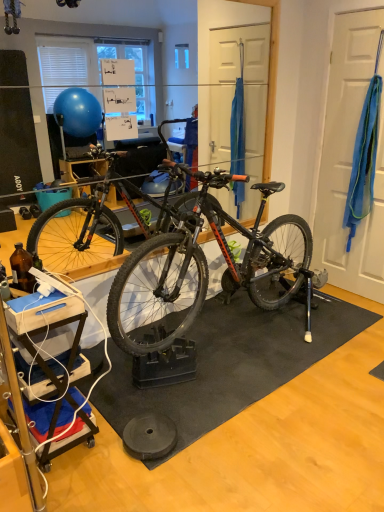
What is the approximate height of black rubber mat at center?

black rubber mat at center is 1.62 inches tall.

Describe the element at coordinates (231, 362) in the screenshot. I see `black rubber mat at center` at that location.

You are a GUI agent. You are given a task and a screenshot of the screen. Output one action in this format:
    pyautogui.click(x=<x>, y=<y>)
    Task: Click on the black rubber mat at center
    Image resolution: width=384 pixels, height=512 pixels.
    Given the screenshot: What is the action you would take?
    pyautogui.click(x=231, y=362)

The image size is (384, 512). What do you see at coordinates (350, 159) in the screenshot? I see `blue fabric at right` at bounding box center [350, 159].

In order to face blue fabric at right, should I rotate leftwards or rightwards?

Rotate right and turn 22.039 degrees.

I want to click on blue fabric at right, so click(350, 159).

From the picture: What is the approximate width of blue fabric at right?

It is 3.32 centimeters.

You are a GUI agent. You are given a task and a screenshot of the screen. Output one action in this format:
    pyautogui.click(x=<x>, y=<y>)
    Task: Click on the black rubber mat at center
    
    Given the screenshot: What is the action you would take?
    pyautogui.click(x=231, y=362)

Is black rubber mat at center at the right side of blue fabric at right?

No, black rubber mat at center is not to the right of blue fabric at right.

Which is behind, black rubber mat at center or blue fabric at right?

blue fabric at right is more distant.

Considering the positions of point (239, 385) and point (336, 23), is point (239, 385) closer or farther from the camera than point (336, 23)?

Point (239, 385).

Based on the photo, from the image's perspective, would you say black rubber mat at center is shown under blue fabric at right?

Yes.

From a real-world perspective, is black rubber mat at center under blue fabric at right?

Yes.

Can you confirm if black rubber mat at center is wider than blue fabric at right?

Correct, the width of black rubber mat at center exceeds that of blue fabric at right.

Is black rubber mat at center taller or shorter than blue fabric at right?

In the image, black rubber mat at center appears to be shorter than blue fabric at right.

Looking at the image, does black rubber mat at center seem bigger or smaller compared to blue fabric at right?

black rubber mat at center is bigger than blue fabric at right.

Does black rubber mat at center contain blue fabric at right?

No, blue fabric at right is not inside black rubber mat at center.

Are black rubber mat at center and blue fabric at right beside each other?

No, black rubber mat at center is not beside blue fabric at right.

Is black rubber mat at center oriented away from blue fabric at right?

No.

How different are the orientations of black rubber mat at center and blue fabric at right in degrees?

89.9 degrees separate the facing orientations of black rubber mat at center and blue fabric at right.

The height and width of the screenshot is (512, 384). I want to click on doormat below the blue fabric at right (from the image's perspective), so click(231, 362).

Between blue fabric at right and black rubber mat at center, which one appears on the left side from the viewer's perspective?

Positioned to the left is black rubber mat at center.

In the image, is blue fabric at right positioned in front of or behind black rubber mat at center?

blue fabric at right is behind black rubber mat at center.

Is point (324, 241) closer or farther from the camera than point (271, 356)?

Point (324, 241).

From the image's perspective, relative to black rubber mat at center, is blue fabric at right above or below?

blue fabric at right is situated higher than black rubber mat at center in the image.

From a real-world perspective, is blue fabric at right physically above black rubber mat at center?

Correct, in the physical world, blue fabric at right is higher than black rubber mat at center.

Can you confirm if blue fabric at right is thinner than black rubber mat at center?

Correct, the width of blue fabric at right is less than that of black rubber mat at center.

Can you confirm if blue fabric at right is shorter than black rubber mat at center?

No.

Looking at the image, does blue fabric at right seem bigger or smaller compared to black rubber mat at center?

Clearly, blue fabric at right is smaller in size than black rubber mat at center.

Is blue fabric at right not inside black rubber mat at center?

Yes, blue fabric at right is located beyond the bounds of black rubber mat at center.

Are blue fabric at right and black rubber mat at center beside each other?

They are not placed beside each other.

Is black rubber mat at center at the back of blue fabric at right?

blue fabric at right does not have its back to black rubber mat at center.

You are a GUI agent. You are given a task and a screenshot of the screen. Output one action in this format:
    pyautogui.click(x=<x>, y=<y>)
    Task: Click on the doormat below the blue fabric at right (from the image's perspective)
    Image resolution: width=384 pixels, height=512 pixels.
    Given the screenshot: What is the action you would take?
    click(x=231, y=362)

Find the location of `doormat on the left of blue fabric at right`. doormat on the left of blue fabric at right is located at coordinates (231, 362).

I want to click on doormat in front of the blue fabric at right, so click(x=231, y=362).